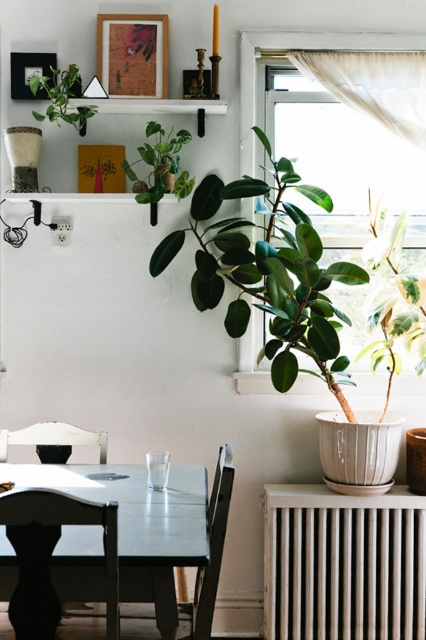
Does white textured radiator at lower right have a smaller size compared to green matte plant at upper center?

Incorrect, white textured radiator at lower right is not smaller in size than green matte plant at upper center.

Based on the photo, which is more to the right, white textured radiator at lower right or green matte plant at upper center?

white textured radiator at lower right

The image size is (426, 640). What are the coordinates of `white textured radiator at lower right` in the screenshot? It's located at click(x=342, y=564).

I want to click on white textured radiator at lower right, so click(x=342, y=564).

Looking at this image, does green rubber plant at center come in front of green matte plant at upper center?

Yes, it is in front of green matte plant at upper center.

Is green rubber plant at center wider than green matte plant at upper center?

Yes.

Does point (394, 257) come behind point (152, 173)?

Yes, it is.

Locate an element on the screen. green rubber plant at center is located at coordinates (270, 273).

Is white textured radiator at lower right smaller than black wood chair at lower left?

No.

Locate an element on the screen. This screenshot has height=640, width=426. white textured radiator at lower right is located at coordinates (342, 564).